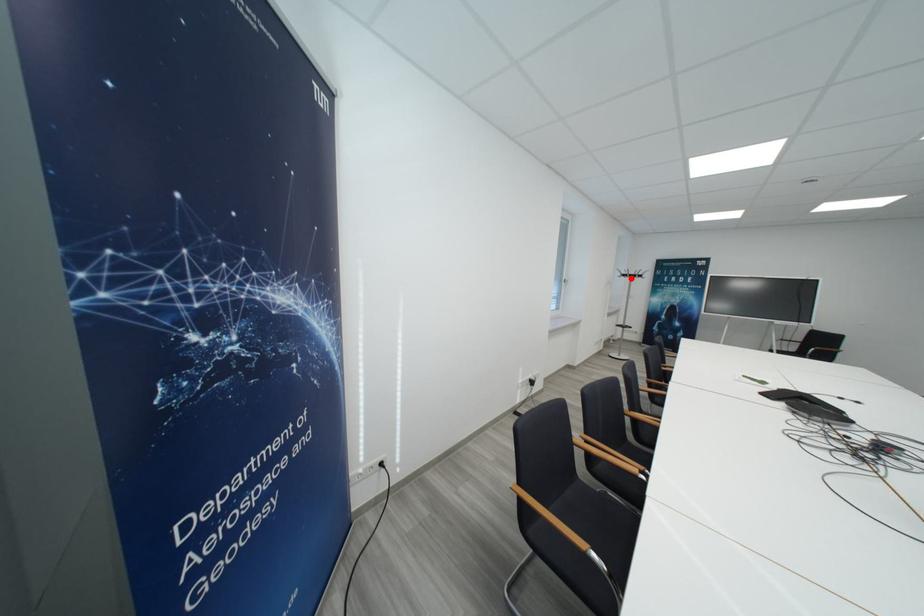
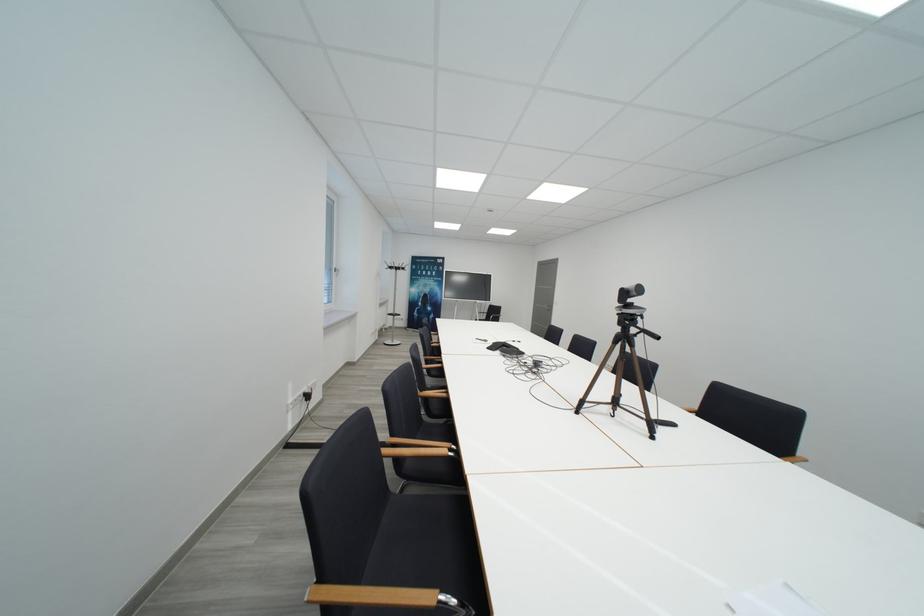
Find the pixel in the second image that matches the highlighted location in the first image.

(397, 270)